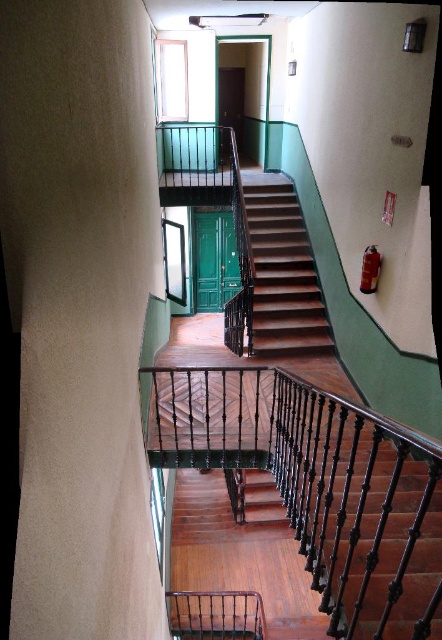
You are a delivery person carrying a large package that is 10 feet long. You need to navigate through the space between the wooden stairs at center and the black wrought iron balustrade at lower center. Can your package fit through this space without bending or breaking it?

The distance between the wooden stairs at center and the black wrought iron balustrade at lower center is 10.29 feet. Since the package is 10 feet long, it can fit through the space as the distance is slightly larger than the package length.

You are standing at the base of the staircase in the image and want to reach a point marked as point (271,204). Given that your average walking speed is 3 feet per second, how long will it take you to reach that point?

The distance between you and point (271,204) is 26.02 feet. At a speed of 3 feet per second, it would take approximately 8.67 seconds to reach the point.

You are standing at the bottom of the staircase and want to reach the landing area. You see the wooden stairs at center and the black wrought iron balustrade at lower center. Which object is closer to you as you start climbing the stairs?

The black wrought iron balustrade at lower center is closer to you because the wooden stairs at center are further away from the viewer.